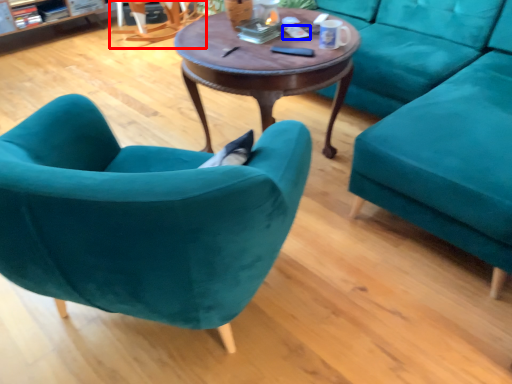
Question: Which point is closer to the camera, armchair (highlighted by a red box) or remote control (highlighted by a blue box)?

Choices:
 (A) armchair
 (B) remote control

Answer: (B)